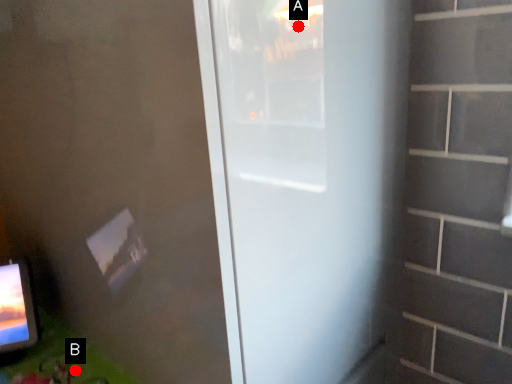
Question: Two points are circled on the image, labeled by A and B beside each circle. Which point appears farthest from the camera in this image?

Choices:
 (A) A is further
 (B) B is further

Answer: (B)